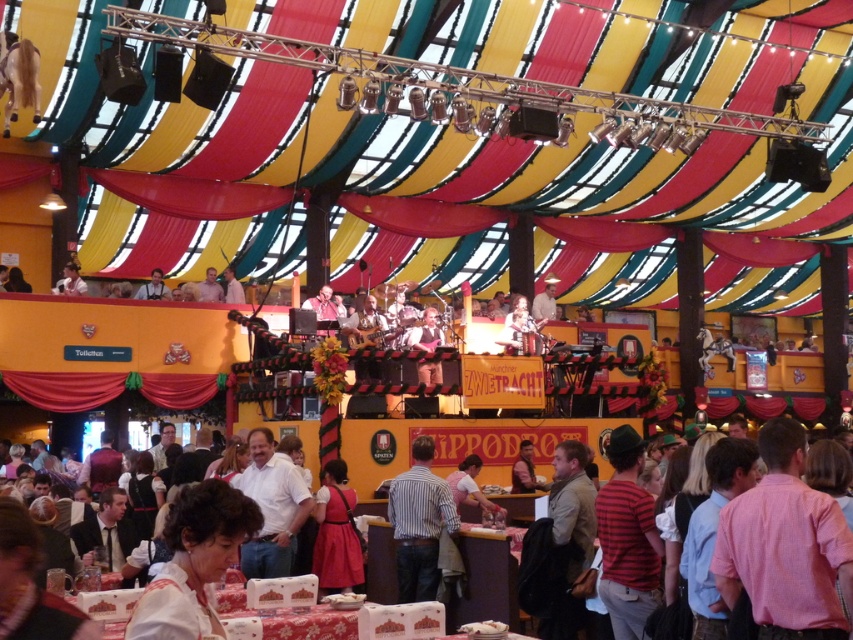
Question: Which of the following is the closest to the observer?

Choices:
 (A) pink cotton shirt at center
 (B) white cotton shirt at center
 (C) pink fabric dress at center
 (D) light beige shirt at upper center

Answer: (A)

Question: Estimate the real-world distances between objects in this image. Which object is closer to the matte white shirt at upper left?

Choices:
 (A) matte black shirt at upper center
 (B) white fabric at upper center
 (C) white satin blouse at lower center

Answer: (A)

Question: Does pink cotton shirt at center appear under light beige shirt at upper center?

Choices:
 (A) yes
 (B) no

Answer: (A)

Question: Can you confirm if white cotton shirt at center is bigger than matte white shirt at upper left?

Choices:
 (A) no
 (B) yes

Answer: (B)

Question: Which point is farther to the camera?

Choices:
 (A) white cotton shirt at center
 (B) pink fabric dress at center
 (C) white fabric at upper center
 (D) matte black shirt at upper center

Answer: (C)

Question: Is the position of pink fabric dress at center more distant than that of matte black shirt at upper center?

Choices:
 (A) yes
 (B) no

Answer: (B)